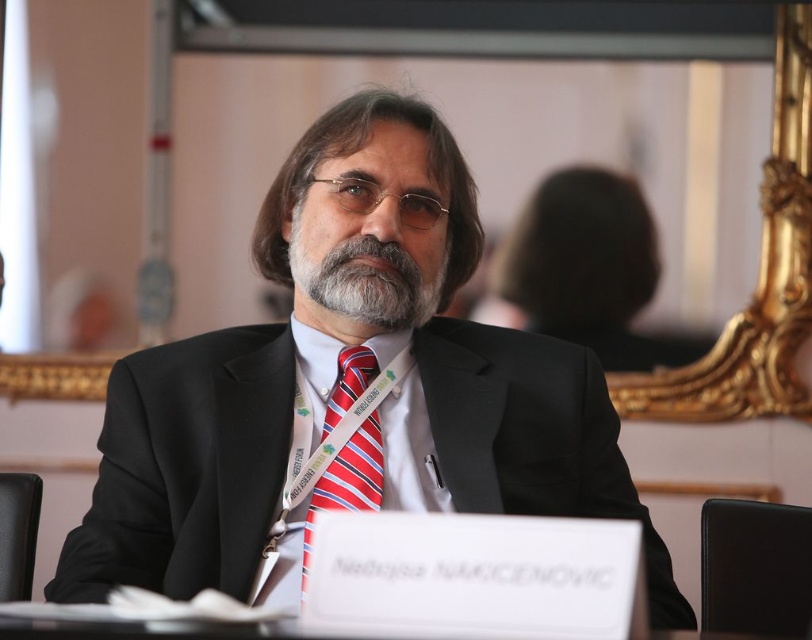
Which is behind, point (426, 284) or point (304, 356)?

Point (304, 356)

Which is behind, point (352, 333) or point (396, 486)?

The point (352, 333) is more distant.

Find the location of a particular element. The height and width of the screenshot is (640, 812). gray matte beard at center is located at coordinates (363, 278).

Can you confirm if black suit at center is positioned below gray matte beard at center?

Yes, black suit at center is below gray matte beard at center.

Is point (245, 563) positioned behind point (356, 321)?

No, it is in front of (356, 321).

Is point (331, 404) positioned behind point (421, 298)?

No, it is in front of (421, 298).

At what (x,y) coordinates should I click in order to perform the action: click on black suit at center. Please return your answer as a coordinate pair (x, y). Looking at the image, I should click on (348, 387).

Does black suit at center have a lesser width compared to striped fabric tie at center?

No.

Who is lower down, black suit at center or striped fabric tie at center?

Positioned lower is striped fabric tie at center.

Is point (173, 344) in front of point (363, 435)?

No.

The image size is (812, 640). I want to click on black suit at center, so click(x=348, y=387).